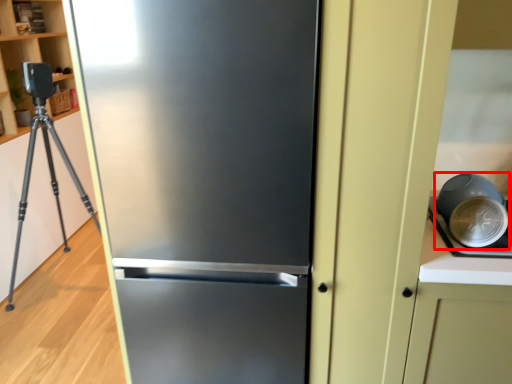
Question: Observing the image, what is the correct spatial positioning of appliance (annotated by the red box) in reference to refrigerator?

Choices:
 (A) left
 (B) right

Answer: (B)